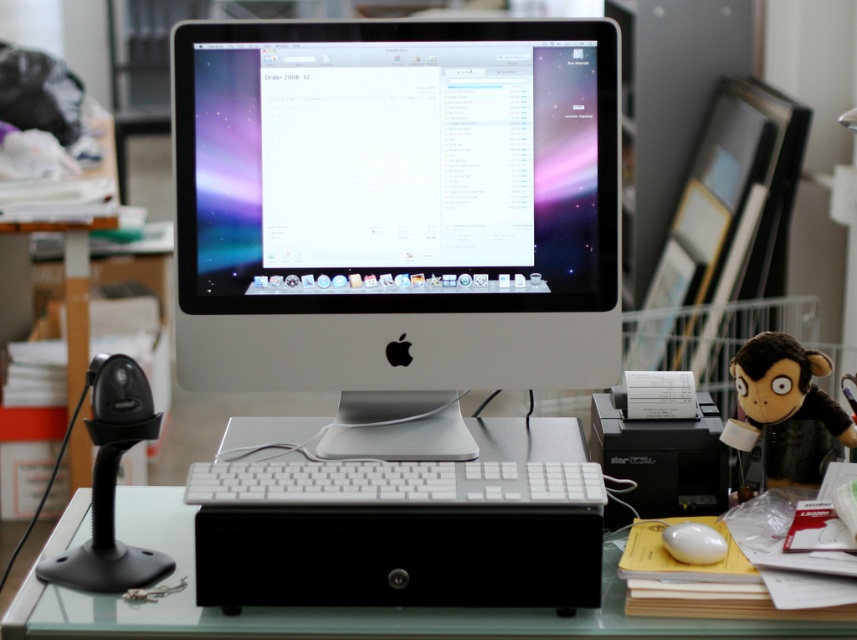
Who is more forward, [34,611] or [568,490]?

Point [34,611] is in front.

Measure the distance from clear glass table at center to white matte keyboard at center.

clear glass table at center is 5.57 inches away from white matte keyboard at center.

Between point (285, 636) and point (573, 483), which one is positioned in front?

Point (285, 636) is in front.

Identify the location of clear glass table at center. This screenshot has width=857, height=640. (327, 605).

Who is higher up, white plastic monitor at center or white plastic keyboard at center?

white plastic monitor at center is above.

Who is shorter, white plastic monitor at center or white plastic keyboard at center?

white plastic keyboard at center is shorter.

Does point (576, 528) come closer to viewer compared to point (472, 592)?

That is True.

This screenshot has height=640, width=857. Find the location of `white plastic monitor at center`. white plastic monitor at center is located at coordinates (397, 301).

In the scene shown: Does white plastic monitor at center have a greater height compared to white matte keyboard at center?

Correct, white plastic monitor at center is much taller as white matte keyboard at center.

Looking at this image, which is more to the right, white plastic monitor at center or white matte keyboard at center?

white matte keyboard at center is more to the right.

Is point (225, 234) more distant than point (439, 465)?

Yes.

Identify the location of white plastic monitor at center. (397, 301).